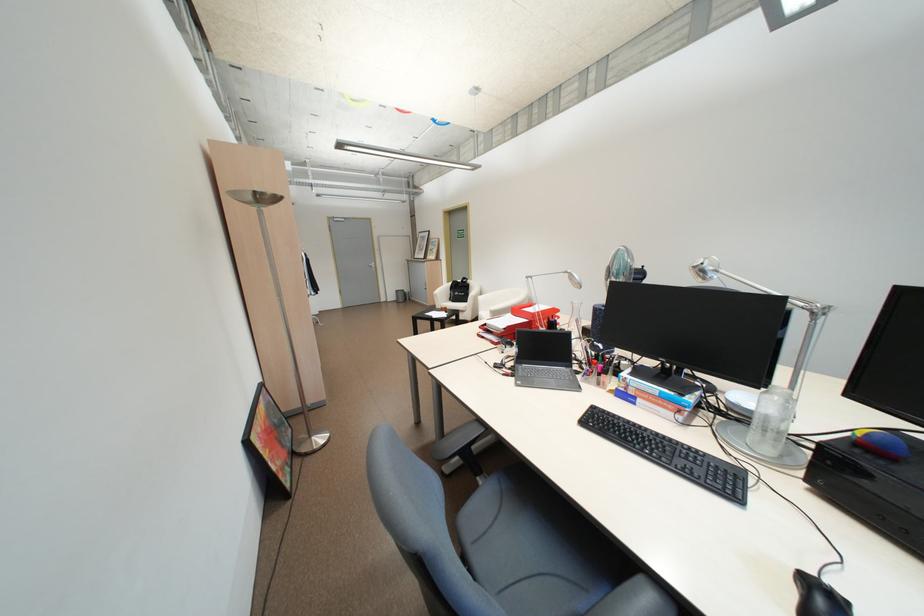
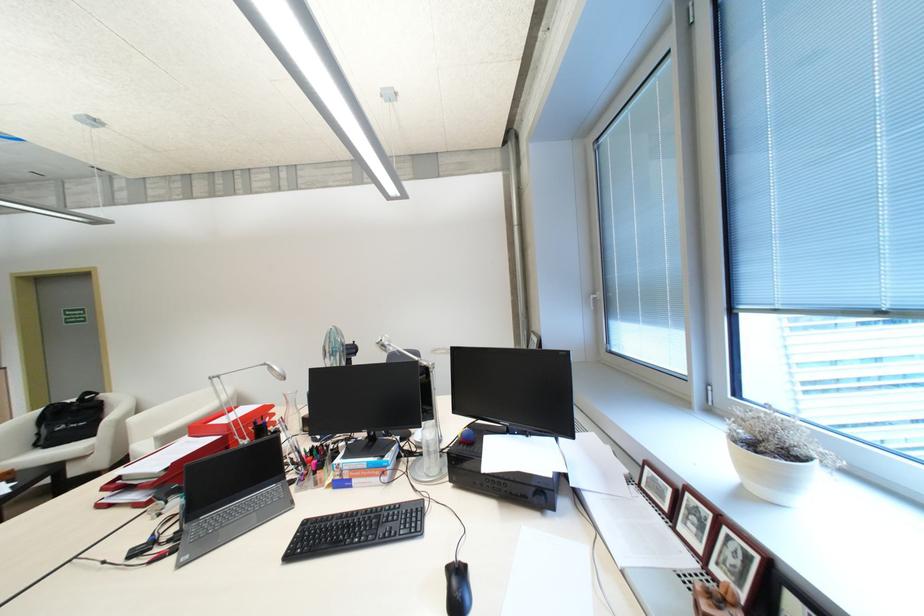
In the second image, find the point that corresponds to point (779, 450) in the first image.

(444, 469)